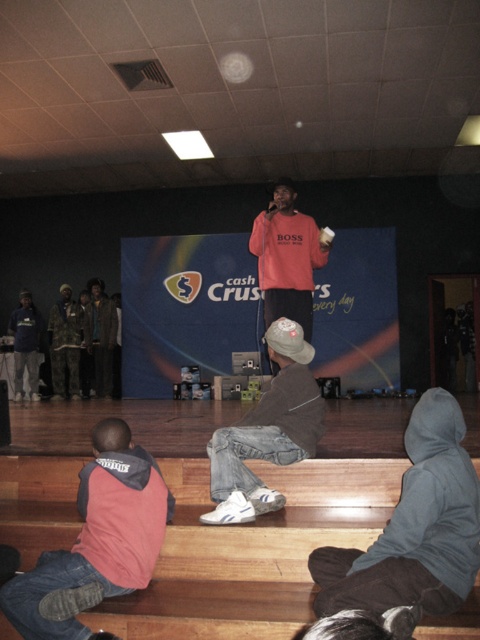
You are an event planner organizing a surprise gift for the performer on stage. The gift needs to be placed on the wooden floor at lower center and the denim jeans at center. Since the wooden floor is larger, where should you place a bigger gift to ensure it fits properly?

The wooden floor at lower center is larger in size than the denim jeans at center, so the bigger gift should be placed on the wooden floor at lower center to ensure it fits properly.

You are a stagehand carrying a 1.5 meter long ladder. You need to place it between the wooden floor at lower center and the matte pink sweatshirt at center. Is there enough space to fit the ladder horizontally between them?

The distance between the wooden floor at lower center and the matte pink sweatshirt at center is 1.29 meters. Since the ladder is 1.5 meters long, it will not fit horizontally between them as the space is shorter than the ladder.